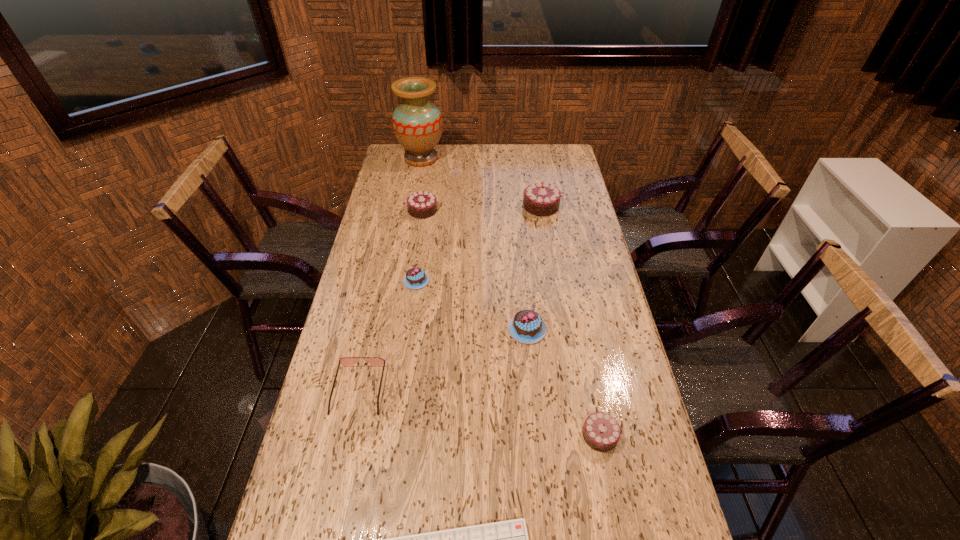
Image resolution: width=960 pixels, height=540 pixels. I want to click on the left pink chocolate cake, so click(415, 278).

Identify the location of pink sunglasses. This screenshot has height=540, width=960. (345, 361).

The image size is (960, 540). I want to click on sunglasses, so click(345, 361).

Where is `vacant space positioned on the front of the tallest object`? vacant space positioned on the front of the tallest object is located at coordinates tap(413, 202).

I want to click on free point located 0.090m on the right of the biggest chocolate chocolate cake, so click(581, 206).

Locate an element on the screen. The height and width of the screenshot is (540, 960). free spot located 0.290m on the right of the leftmost chocolate chocolate cake is located at coordinates (509, 210).

Where is `free space located 0.370m on the back of the fifth farthest object`? Image resolution: width=960 pixels, height=540 pixels. free space located 0.370m on the back of the fifth farthest object is located at coordinates (518, 240).

Where is `blank area located 0.050m on the left of the nearest chocolate cake`? The height and width of the screenshot is (540, 960). blank area located 0.050m on the left of the nearest chocolate cake is located at coordinates (563, 435).

Find the location of a particular element. vacant region located on the right of the farther pink chocolate cake is located at coordinates (514, 281).

I want to click on vacant space situated on the bridge of the sunglasses, so click(x=329, y=524).